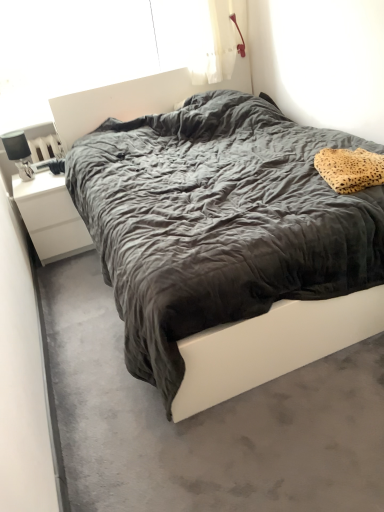
Locate an element on the screen. Image resolution: width=384 pixels, height=512 pixels. vacant space situated above white matte nightstand at left (from a real-world perspective) is located at coordinates (39, 178).